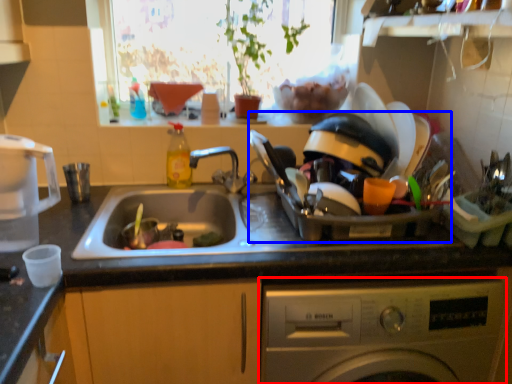
Question: Which of the following is the farthest to the observer, washing machine (highlighted by a red box) or appliance (highlighted by a blue box)?

Choices:
 (A) washing machine
 (B) appliance

Answer: (B)